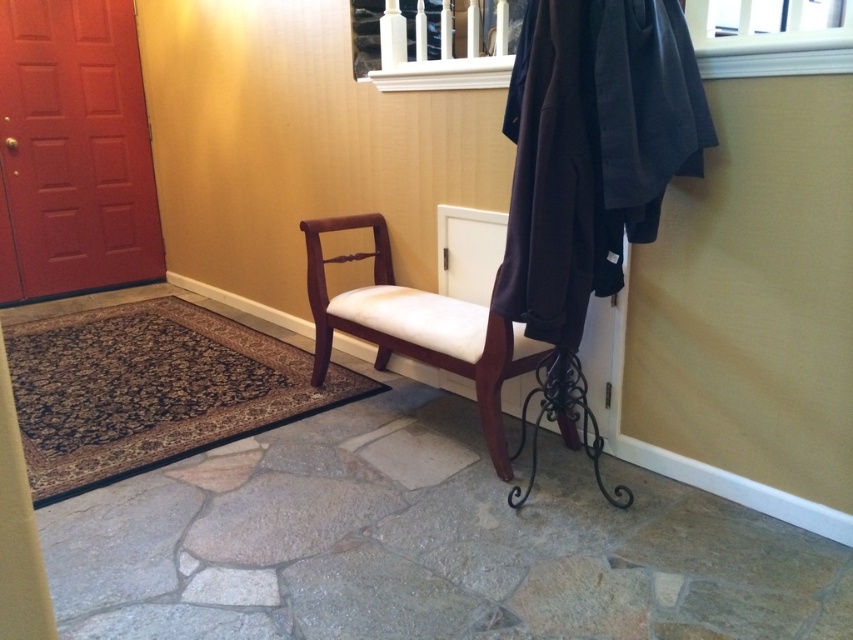
Question: Does dark woolen robe at upper right appear over matte red door at left?

Choices:
 (A) no
 (B) yes

Answer: (A)

Question: Does dark woolen robe at upper right have a greater width compared to matte red door at left?

Choices:
 (A) yes
 (B) no

Answer: (B)

Question: Estimate the real-world distances between objects in this image. Which object is farther from the dark woolen robe at upper right?

Choices:
 (A) matte red door at left
 (B) mahogany wood chair at center

Answer: (A)

Question: Considering the relative positions of dark woolen robe at upper right and matte red door at left in the image provided, where is dark woolen robe at upper right located with respect to matte red door at left?

Choices:
 (A) left
 (B) right

Answer: (B)

Question: Among these points, which one is farthest from the camera?

Choices:
 (A) (657, 218)
 (B) (57, 208)
 (C) (318, 310)

Answer: (B)

Question: Among these points, which one is farthest from the camera?

Choices:
 (A) (665, 20)
 (B) (454, 353)

Answer: (B)